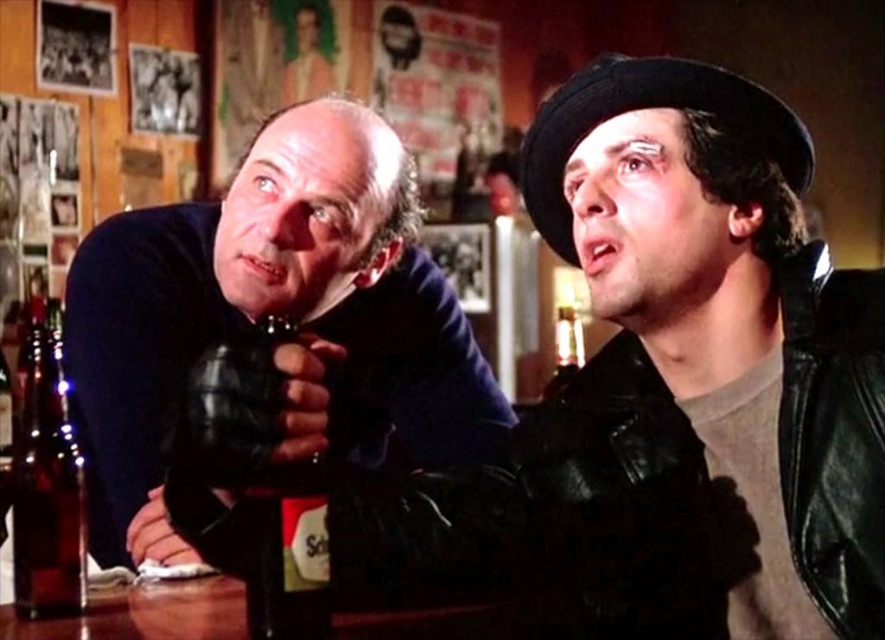
The image size is (885, 640). Describe the element at coordinates (274, 308) in the screenshot. I see `dark blue sweater at left` at that location.

Who is positioned more to the right, dark blue sweater at left or translucent glass bottle at center?

From the viewer's perspective, translucent glass bottle at center appears more on the right side.

Between point (145, 403) and point (560, 316), which one is positioned behind?

The point (560, 316) is more distant.

Locate an element on the screen. Image resolution: width=885 pixels, height=640 pixels. dark blue sweater at left is located at coordinates (274, 308).

Image resolution: width=885 pixels, height=640 pixels. What do you see at coordinates (274, 308) in the screenshot?
I see `dark blue sweater at left` at bounding box center [274, 308].

You are a GUI agent. You are given a task and a screenshot of the screen. Output one action in this format:
    pyautogui.click(x=<x>, y=<y>)
    Task: Click on the dark blue sweater at left
    
    Given the screenshot: What is the action you would take?
    pyautogui.click(x=274, y=308)

Is translucent glass bottle at lower left thinner than translucent glass bottle at center?

Yes, translucent glass bottle at lower left is thinner than translucent glass bottle at center.

Can you confirm if translucent glass bottle at lower left is bigger than translucent glass bottle at center?

No, translucent glass bottle at lower left is not bigger than translucent glass bottle at center.

Does point (50, 602) come behind point (573, 349)?

No, (50, 602) is closer to viewer.

Identify the location of translucent glass bottle at lower left. The height and width of the screenshot is (640, 885). (47, 488).